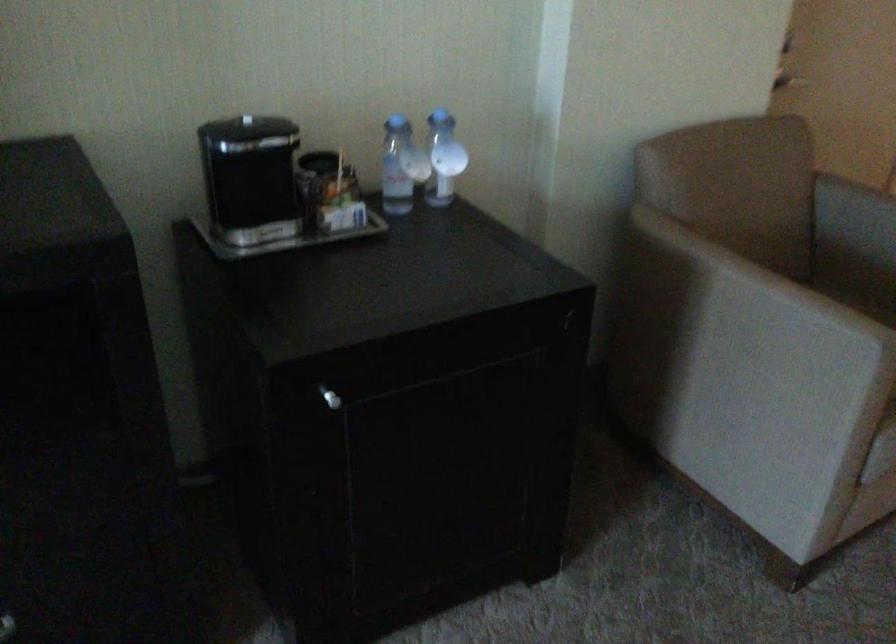
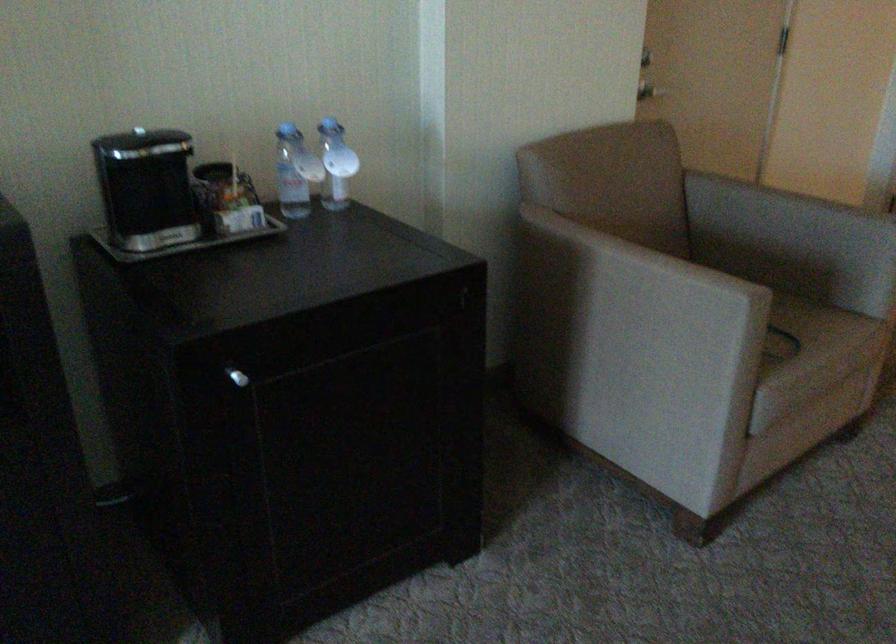
Find the pixel in the second image that matches (x=859, y=303) in the first image.

(734, 278)